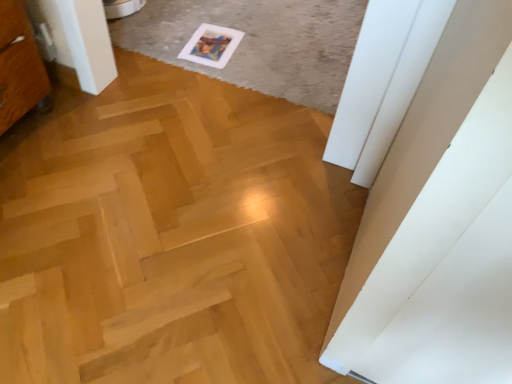
Find the location of `free spot to the right of white paper postcard at upper center`. free spot to the right of white paper postcard at upper center is located at coordinates (262, 50).